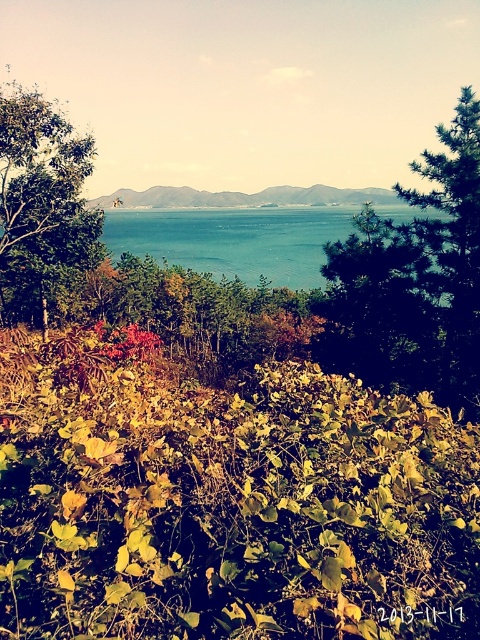
Question: Can you confirm if yellow-green leafy bush at lower center is positioned above green leafy tree at upper left?

Choices:
 (A) no
 (B) yes

Answer: (A)

Question: Observing the image, what is the correct spatial positioning of green textured tree at upper right in reference to blue water at center?

Choices:
 (A) right
 (B) left

Answer: (B)

Question: Which point appears closest to the camera in this image?

Choices:
 (A) (48, 186)
 (B) (218, 548)
 (C) (437, 157)

Answer: (B)

Question: Which is farther from the blue water at center?

Choices:
 (A) green textured tree at upper right
 (B) green leafy tree at upper left
 (C) yellow-green leafy bush at lower center
 (D) green leafy hillside at center

Answer: (C)

Question: Is green textured tree at upper right below blue water at center?

Choices:
 (A) no
 (B) yes

Answer: (B)

Question: Which of the following is the closest to the observer?

Choices:
 (A) pyautogui.click(x=90, y=248)
 (B) pyautogui.click(x=411, y=566)
 (C) pyautogui.click(x=357, y=243)
 (D) pyautogui.click(x=439, y=376)

Answer: (B)